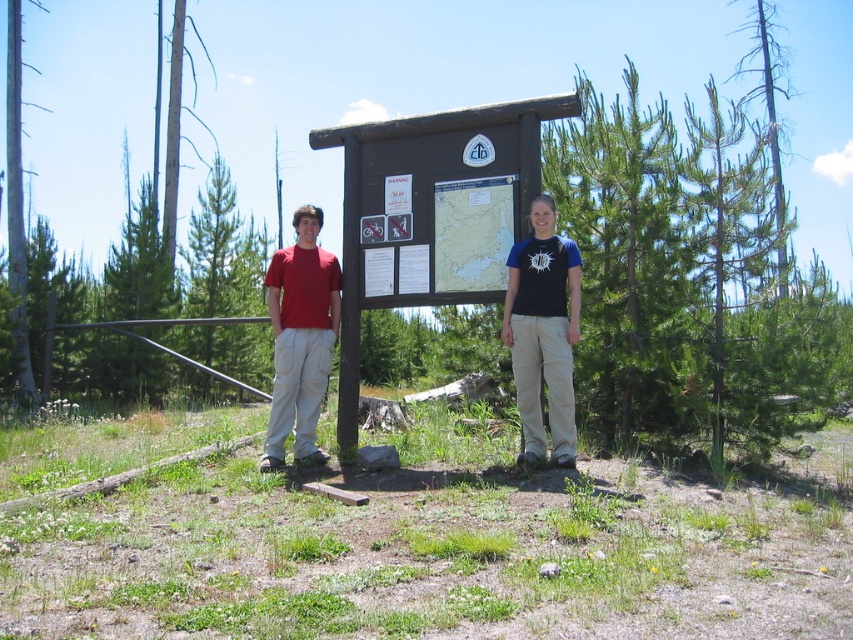
Is matte red t-shirt at left positioned in front of smooth bark tree at left?

Yes.

Is matte red t-shirt at left taller than smooth bark tree at left?

Yes.

Does point (273, 461) come behind point (15, 285)?

That is False.

Locate an element on the screen. This screenshot has width=853, height=640. matte red t-shirt at left is located at coordinates (300, 339).

Based on the photo, is matte red t-shirt at left smaller than matte red shirt at center?

Yes, matte red t-shirt at left is smaller than matte red shirt at center.

Can you confirm if matte red t-shirt at left is taller than matte red shirt at center?

In fact, matte red t-shirt at left may be shorter than matte red shirt at center.

Which is behind, point (258, 465) or point (573, 461)?

The point (258, 465) is behind.

Locate an element on the screen. matte red t-shirt at left is located at coordinates (300, 339).

Is wooden sign at center positioned behind blue cotton shirt at center?

Yes, wooden sign at center is behind blue cotton shirt at center.

This screenshot has width=853, height=640. What do you see at coordinates (437, 200) in the screenshot?
I see `wooden sign at center` at bounding box center [437, 200].

Measure the distance between point [471,118] and camera.

Point [471,118] is 7.30 meters away from camera.

The height and width of the screenshot is (640, 853). Find the location of `wooden sign at center`. wooden sign at center is located at coordinates (437, 200).